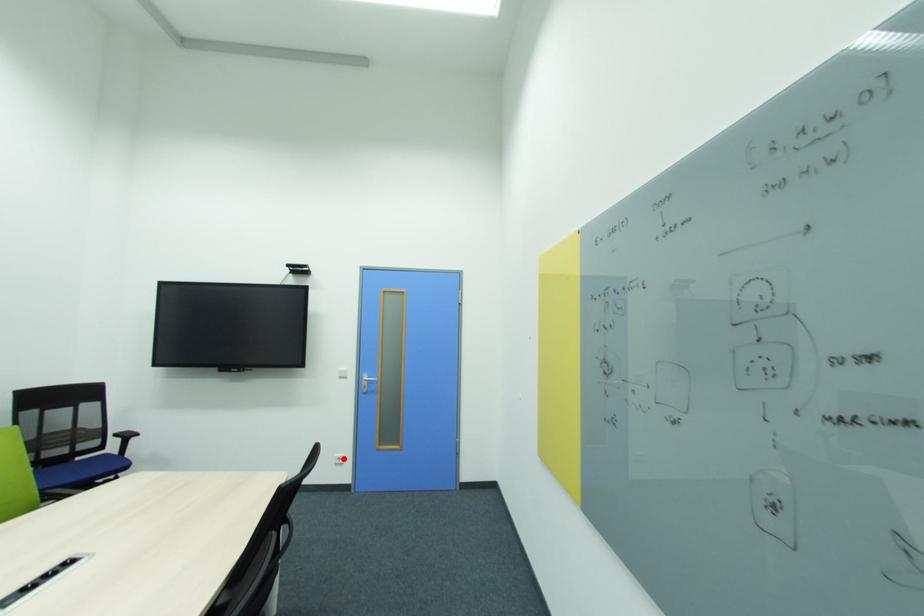
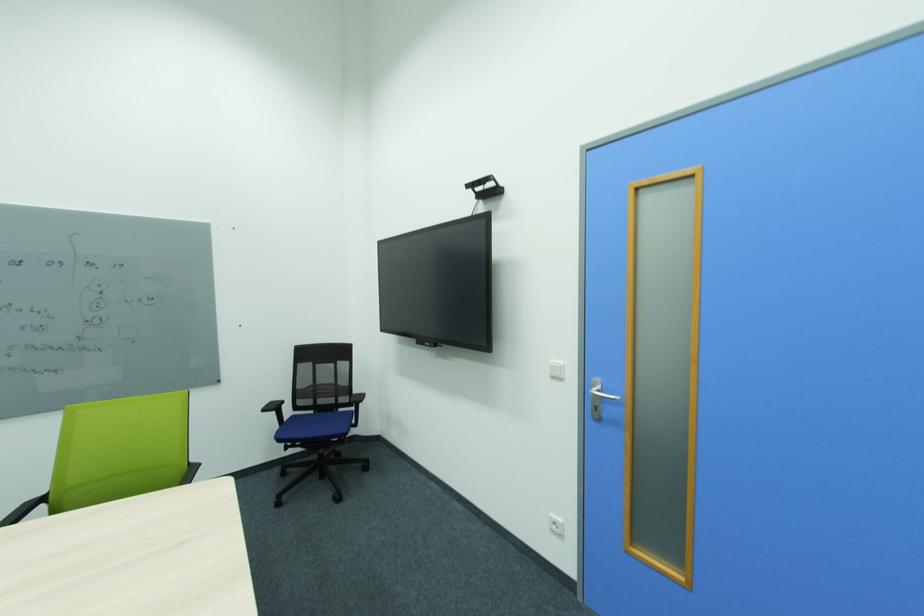
Question: I am providing you with two images of the same scene from different viewpoints. In image1, a red point is highlighted. Considering the same 3D point in image2, which of the following is correct?

Choices:
 (A) It is closer
 (B) It is farther

Answer: (A)